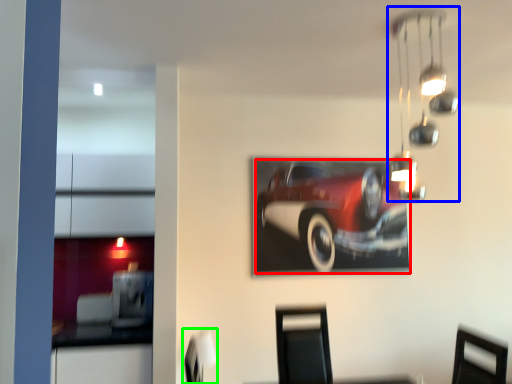
Question: Which object is positioned closest to car (highlighted by a red box)? Select from lamp (highlighted by a blue box) and swivel chair (highlighted by a green box).

Choices:
 (A) lamp
 (B) swivel chair

Answer: (A)